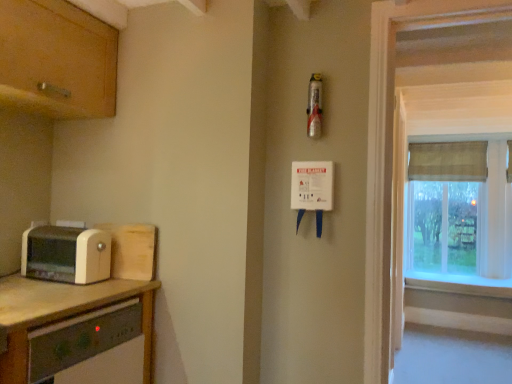
Question: From the image's perspective, is clear plastic screen door at right located above or below white painted wood at right?

Choices:
 (A) below
 (B) above

Answer: (B)

Question: Considering the relative positions of clear plastic screen door at right and white painted wood at right in the image provided, is clear plastic screen door at right to the left or to the right of white painted wood at right?

Choices:
 (A) right
 (B) left

Answer: (B)

Question: Estimate the real-world distances between objects in this image. Which object is closer to the wooden toaster at left, which is counted as the second cabinetry, starting from the top?

Choices:
 (A) white laminate countertop at lower left
 (B) beige plastic toaster at left
 (C) textured beige curtain at right
 (D) wooden cabinet at upper left, which is the first cabinetry in top-to-bottom order
 (E) wooden window frame at right

Answer: (B)

Question: Considering the real-world distances, which object is farthest from the wooden window frame at right?

Choices:
 (A) brown fabric curtain at right
 (B) wooden toaster at left, the first cabinetry ordered from the bottom
 (C) wooden cabinet at upper left, which is the first cabinetry in top-to-bottom order
 (D) beige plastic toaster at left
 (E) white painted wood at right

Answer: (A)